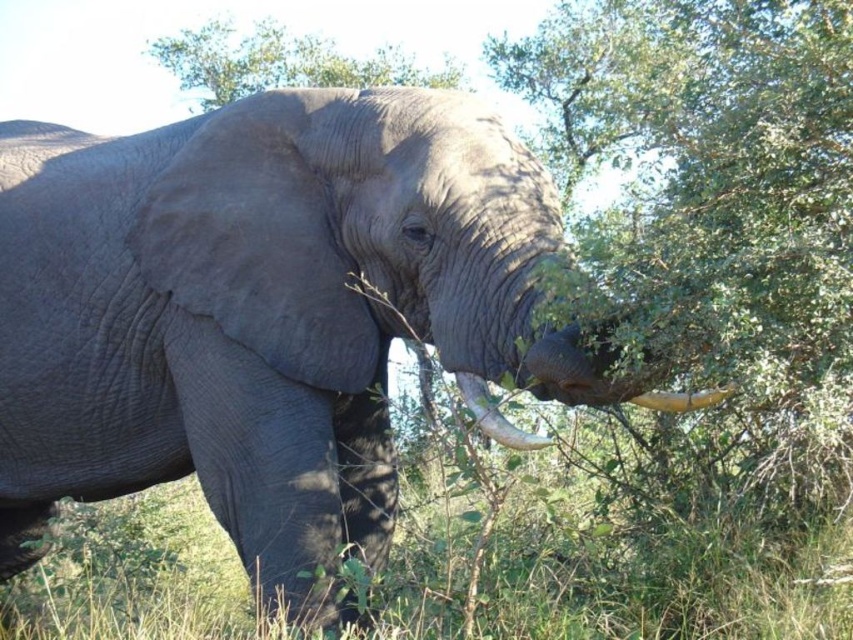
Can you confirm if green grass at lower left is positioned to the right of green leafy tree at center?

No, green grass at lower left is not to the right of green leafy tree at center.

Measure the distance between green grass at lower left and green leafy tree at center.

green grass at lower left and green leafy tree at center are 12.94 feet apart from each other.

Describe the element at coordinates (630, 532) in the screenshot. The width and height of the screenshot is (853, 640). I see `green grass at lower left` at that location.

This screenshot has height=640, width=853. Find the location of `green grass at lower left`. green grass at lower left is located at coordinates (630, 532).

How far apart are gray matte elephant at center and green leafy tree at center?

They are 4.79 meters apart.

Does gray matte elephant at center appear under green leafy tree at center?

Yes.

Is point (97, 256) farther from viewer compared to point (746, 372)?

Yes.

Find the location of `gray matte elephant at center`. gray matte elephant at center is located at coordinates (259, 310).

Who is taller, green leafy tree at upper center or matte gray tusk at lower left?

Standing taller between the two is green leafy tree at upper center.

Who is positioned more to the left, green leafy tree at upper center or matte gray tusk at lower left?

From the viewer's perspective, green leafy tree at upper center appears more on the left side.

Is point (225, 83) closer to viewer compared to point (650, 392)?

No.

What are the coordinates of `green leafy tree at upper center` in the screenshot? It's located at [279, 61].